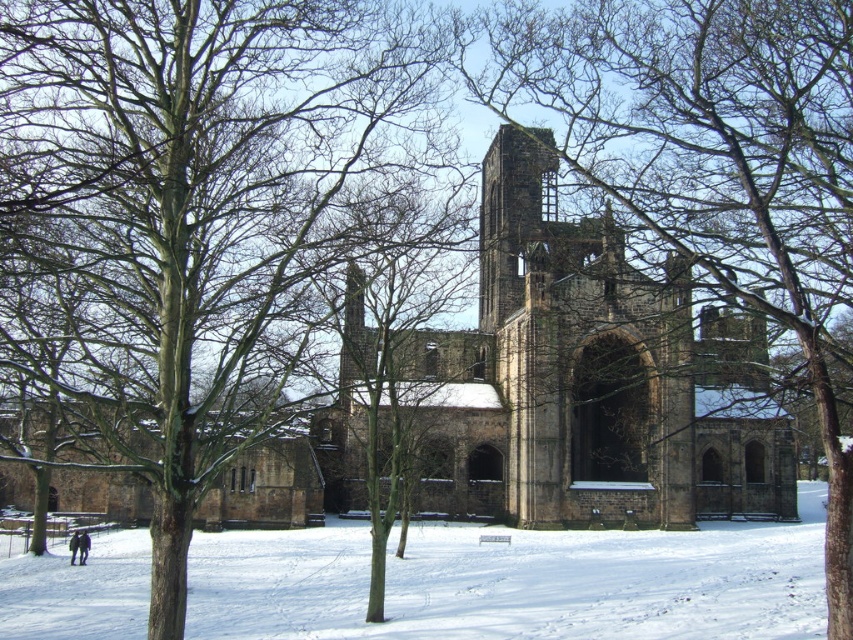
How far apart are brown bark tree at center and white powdery snow at lower center?

The distance of brown bark tree at center from white powdery snow at lower center is 31.08 meters.

Does point (752, 64) lie in front of point (466, 602)?

No.

Is point (740, 33) positioned after point (219, 560)?

That is False.

What are the coordinates of `brown bark tree at center` in the screenshot? It's located at (714, 166).

Is brown stone church at center in front of dark blue jacket at lower left?

Yes, it is in front of dark blue jacket at lower left.

Between brown stone church at center and dark blue jacket at lower left, which one is positioned lower?

dark blue jacket at lower left is below.

This screenshot has height=640, width=853. I want to click on brown stone church at center, so click(590, 378).

Who is positioned more to the left, smooth bark tree at center or dark brown leather jacket at lower left?

dark brown leather jacket at lower left is more to the left.

Which is behind, point (428, 49) or point (84, 544)?

Positioned behind is point (84, 544).

This screenshot has width=853, height=640. I want to click on smooth bark tree at center, so click(202, 214).